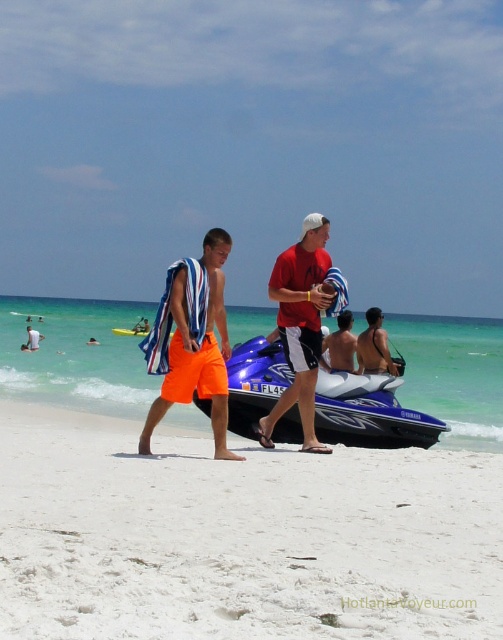
You are a photographer trying to capture a photo of the blue glossy jet ski at center. There is a person with smooth tan skin at center blocking your view. Can you see the jet ski through the person?

The smooth tan skin at center is closer to the viewer than the blue glossy jet ski at center, so the person is blocking the view of the jet ski.

You are standing at the beach and want to reach the point marked at coordinates (x=334, y=344). Given that you can walk 1.5 meters per second, how long will it take you to reach that point?

The distance to the point is 14.18 meters. At a walking speed of 1.5 meters per second, it will take approximately 9.45 seconds to reach the point.